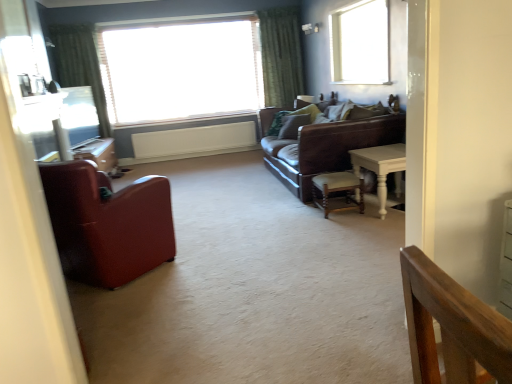
The image size is (512, 384). I want to click on vacant region to the left of wooden chair at center, which is the second chair from left to right, so click(x=301, y=217).